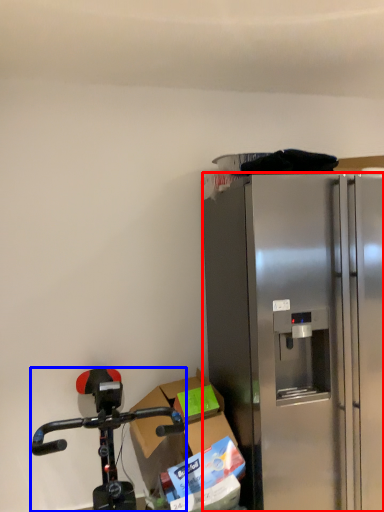
Question: Among these objects, which one is nearest to the camera, refrigerator (highlighted by a red box) or bicycle (highlighted by a blue box)?

Choices:
 (A) refrigerator
 (B) bicycle

Answer: (B)